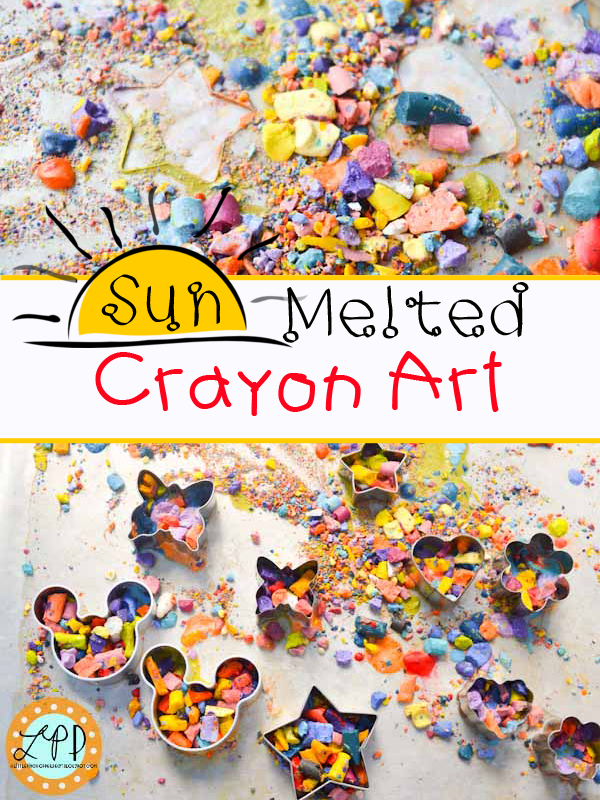
This screenshot has height=800, width=600. I want to click on art, so click(395, 374).